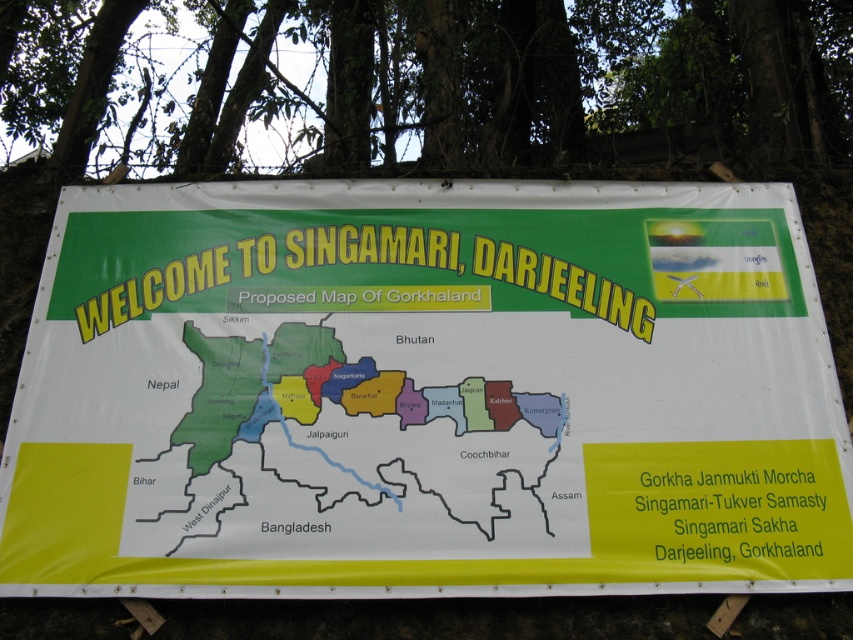
How far apart are white paper poster at center and green leafy tree at upper center?

white paper poster at center and green leafy tree at upper center are 28.17 inches apart from each other.

Is point (136, 435) in front of point (39, 240)?

Yes, point (136, 435) is in front of point (39, 240).

The height and width of the screenshot is (640, 853). Identify the location of white paper poster at center. (425, 392).

The height and width of the screenshot is (640, 853). I want to click on white paper poster at center, so click(425, 392).

Is point (392, 374) closer to viewer compared to point (544, 426)?

No, it is behind (544, 426).

Is white paper poster at center taller than yellow paper map at center?

Result: Yes, white paper poster at center is taller than yellow paper map at center.

Describe the element at coordinates (425, 392) in the screenshot. This screenshot has width=853, height=640. I see `white paper poster at center` at that location.

You are a GUI agent. You are given a task and a screenshot of the screen. Output one action in this format:
    pyautogui.click(x=<x>, y=<y>)
    Task: Click on the white paper poster at center
    Image resolution: width=853 pixels, height=640 pixels.
    Given the screenshot: What is the action you would take?
    click(425, 392)

Looking at this image, can you confirm if green leafy tree at upper center is taller than yellow paper map at center?

Yes.

Between green leafy tree at upper center and yellow paper map at center, which one has more height?

green leafy tree at upper center is taller.

The image size is (853, 640). I want to click on green leafy tree at upper center, so click(560, 99).